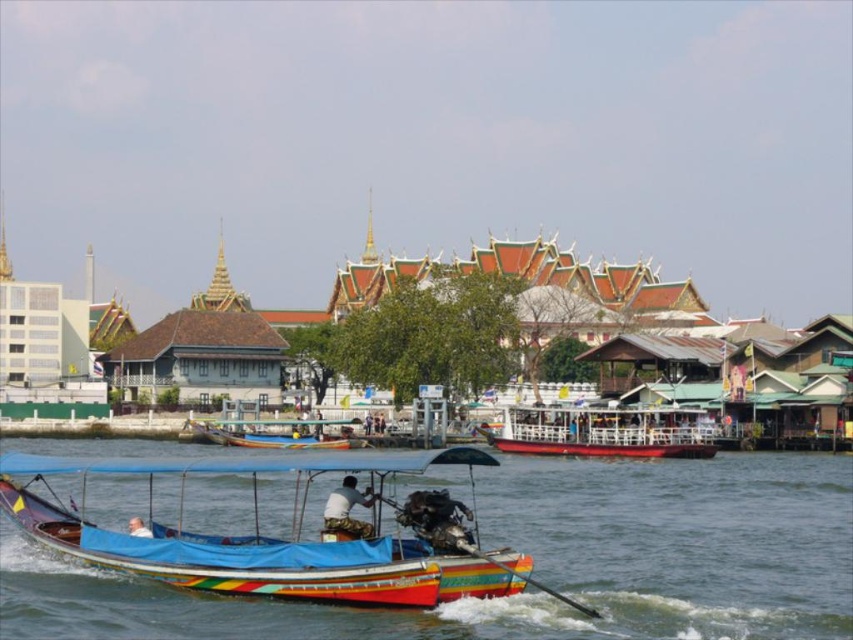
Question: Is golden ornate palace at center below wooden boat at center?

Choices:
 (A) no
 (B) yes

Answer: (A)

Question: Can you confirm if multicolored fabric boat at center is bigger than wooden boat at center?

Choices:
 (A) no
 (B) yes

Answer: (B)

Question: Which object appears closest to the camera in this image?

Choices:
 (A) white wooden boat at center
 (B) multicolored fabric boat at center
 (C) wooden boat at center
 (D) golden ornate palace at center

Answer: (B)

Question: Can you confirm if golden ornate palace at center is positioned to the right of white wooden boat at center?

Choices:
 (A) yes
 (B) no

Answer: (B)

Question: Which object is closer to the camera taking this photo?

Choices:
 (A) wooden boat at center
 (B) white wooden boat at center
 (C) multicolored fabric boat at center
 (D) golden ornate palace at center

Answer: (C)

Question: Based on their relative distances, which object is farther from the golden ornate palace at center?

Choices:
 (A) white wooden boat at center
 (B) wooden boat at center
 (C) multicolored fabric boat at center

Answer: (C)